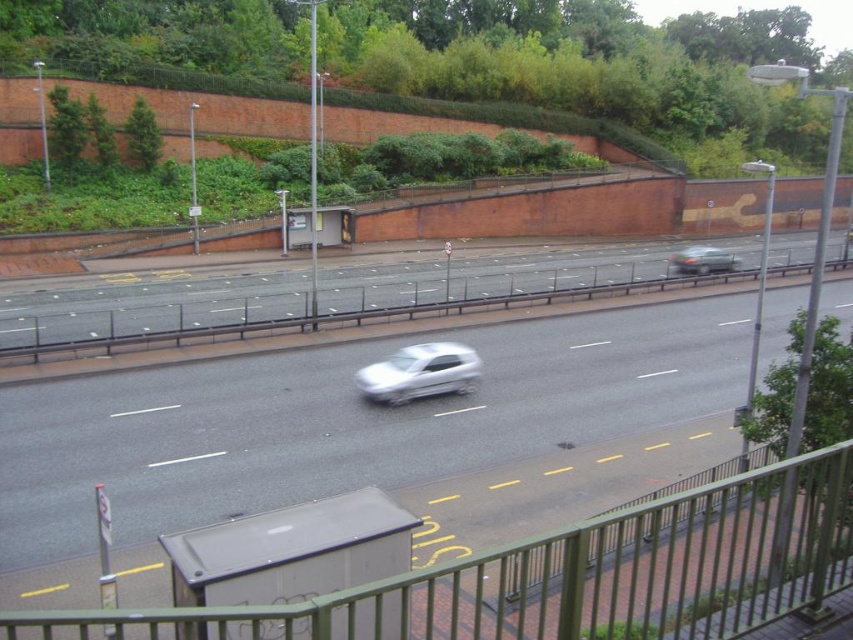
Question: Which is nearer to the white glossy car at center?

Choices:
 (A) gray asphalt highway at center
 (B) green metallic car at right

Answer: (A)

Question: Among these objects, which one is farthest from the camera?

Choices:
 (A) smooth gray road at center
 (B) gray asphalt highway at center
 (C) white glossy car at center
 (D) green metal fence at lower center

Answer: (A)

Question: Can you confirm if green metal fence at lower center is wider than white glossy car at center?

Choices:
 (A) yes
 (B) no

Answer: (A)

Question: Based on their relative distances, which object is nearer to the gray asphalt highway at center?

Choices:
 (A) green metal fence at lower center
 (B) smooth gray road at center
 (C) white glossy car at center

Answer: (A)

Question: Can you confirm if gray asphalt highway at center is wider than smooth gray road at center?

Choices:
 (A) yes
 (B) no

Answer: (B)

Question: Does green metal fence at lower center have a lesser width compared to smooth gray road at center?

Choices:
 (A) no
 (B) yes

Answer: (B)